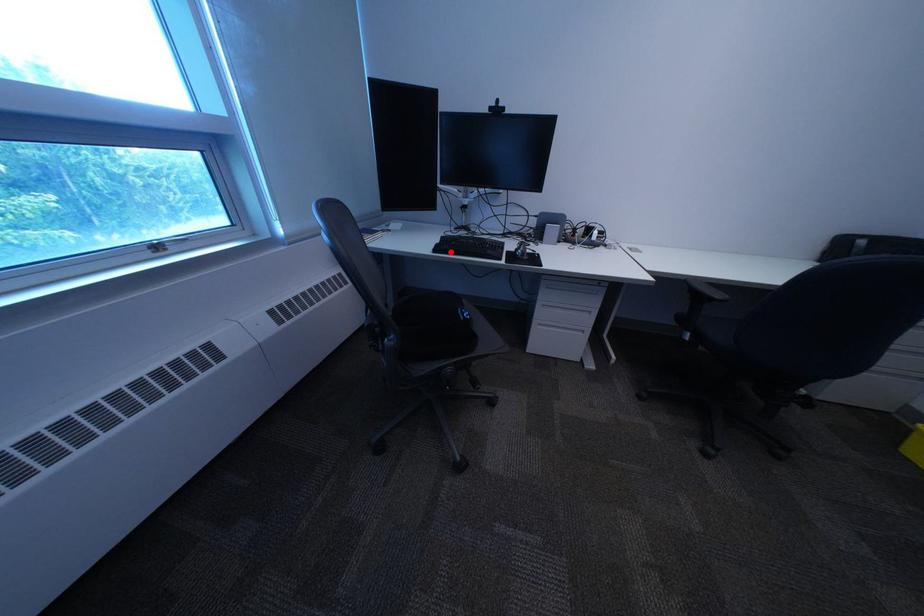
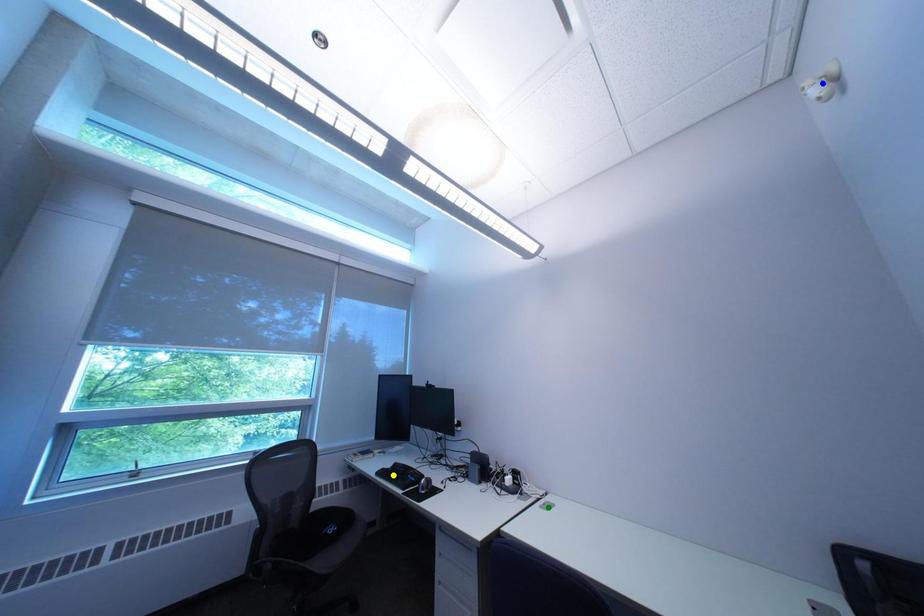
Question: I am providing you with two images of the same scene from different viewpoints. A red point is marked on the first image. You are given multiple points on the second image. In image 2, which mark is for the same physical point as the one in image 1?

Choices:
 (A) green point
 (B) blue point
 (C) yellow point

Answer: (C)